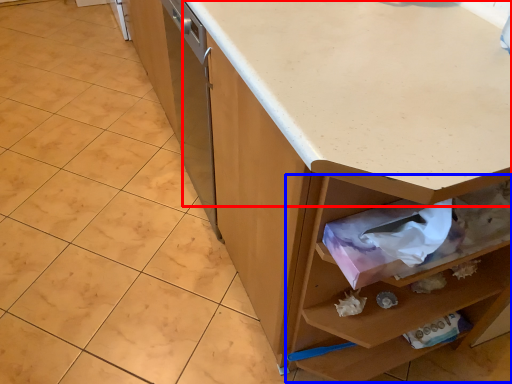
Question: Which of the following is the closest to the observer, countertop (highlighted by a red box) or drawer (highlighted by a blue box)?

Choices:
 (A) countertop
 (B) drawer

Answer: (A)